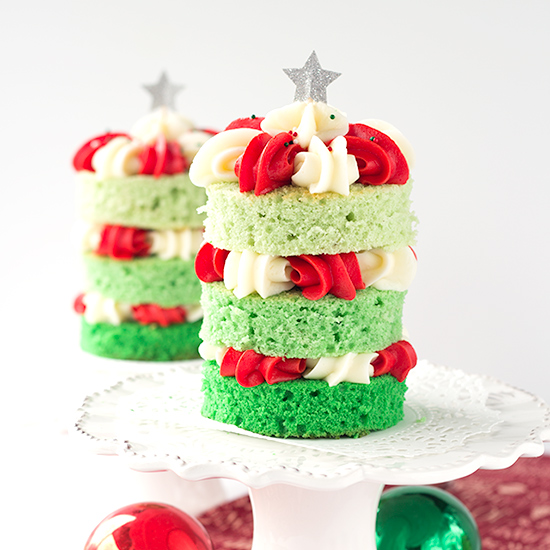
Locate an element on the screen. This screenshot has width=550, height=550. red bulb is located at coordinates (142, 530).